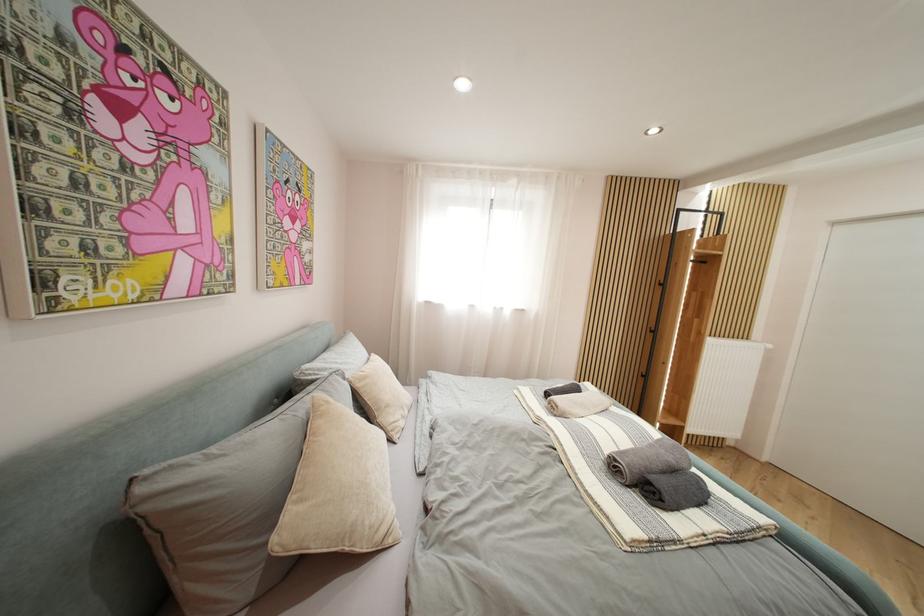
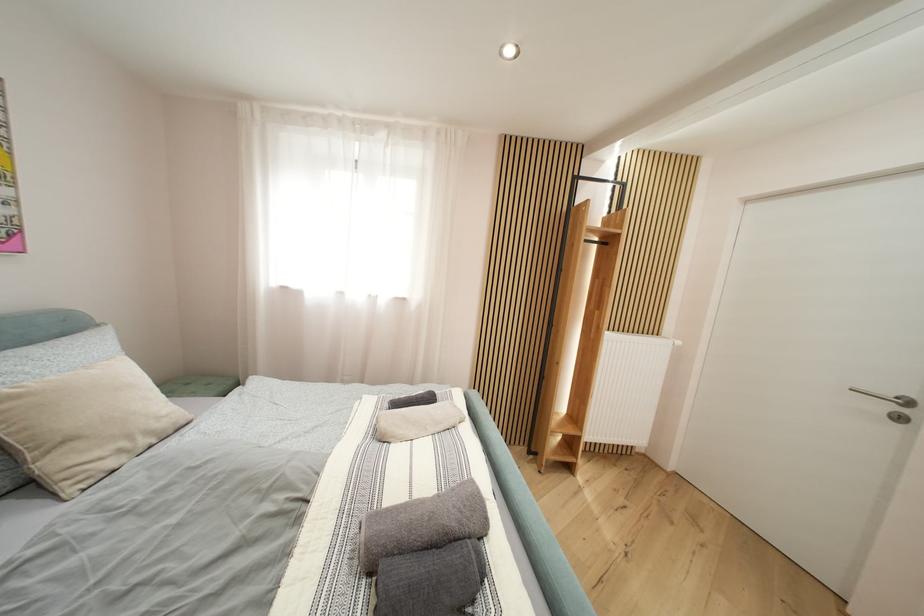
The images are taken continuously from a first-person perspective. In which direction are you moving?

The cameraman moved toward right, forward.